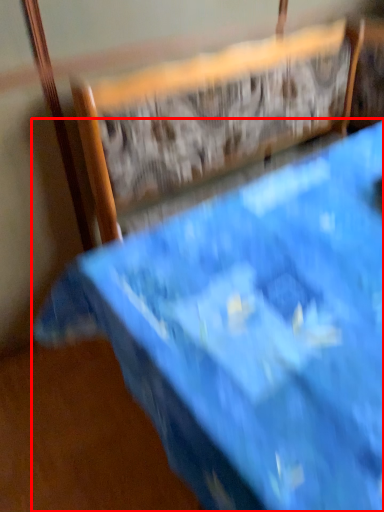
Question: From the image's perspective, what is the correct spatial relationship of furniture (annotated by the red box) in relation to chair?

Choices:
 (A) above
 (B) below

Answer: (B)